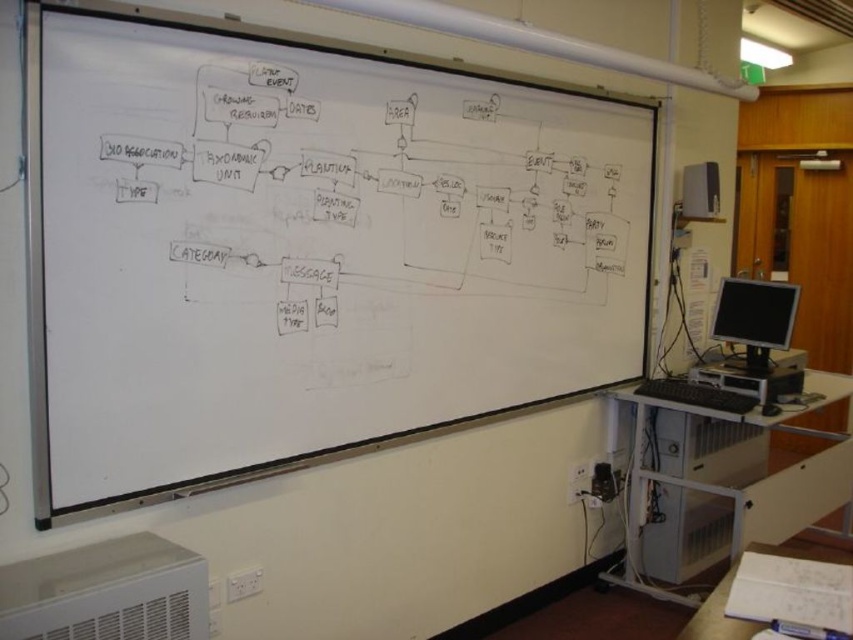
You are a student in the classroom and need to place a book between the metallic gray computer tower at lower right and the black glossy monitor at right. Which object should you place the book closer to if you want the book to be closer to the taller object?

The metallic gray computer tower at lower right is much taller than the black glossy monitor at right. Therefore, to place the book closer to the taller object, you should position it nearer to the metallic gray computer tower at lower right.